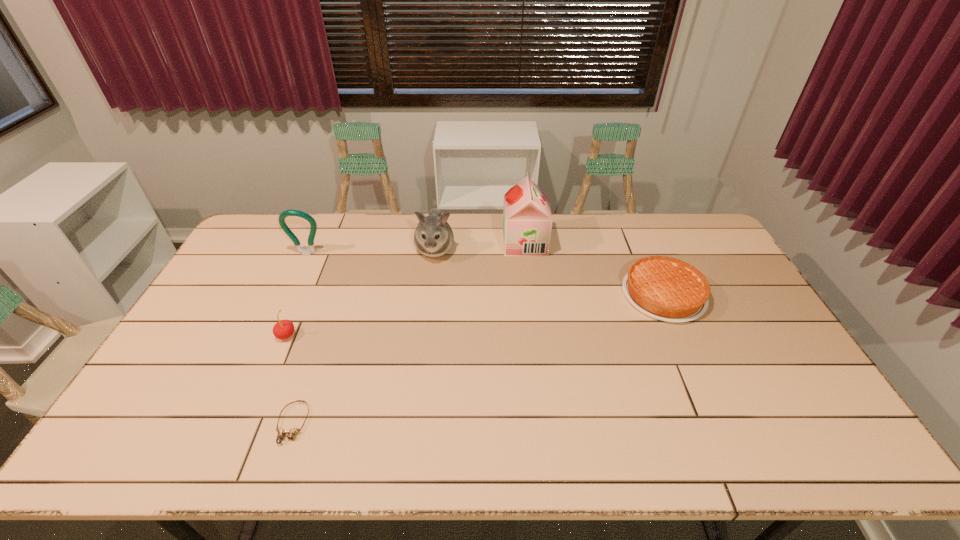
I want to click on vacant area that lies between the cherry and the fifth tallest object, so click(x=475, y=315).

In order to click on empty location between the tallest object and the fourth object from right to left in this screenshot , I will do `click(409, 333)`.

Image resolution: width=960 pixels, height=540 pixels. What are the coordinates of `vacant region between the fourth object from right to left and the cherry` in the screenshot? It's located at (289, 379).

This screenshot has height=540, width=960. I want to click on vacant space that's between the hamster and the bottle opener, so click(371, 252).

You are a GUI agent. You are given a task and a screenshot of the screen. Output one action in this format:
    pyautogui.click(x=<x>, y=<y>)
    Task: Click on the empty space between the hamster and the tallest object
    The height and width of the screenshot is (540, 960).
    Given the screenshot: What is the action you would take?
    pyautogui.click(x=480, y=246)

Identify the location of empty space that is in between the second shortest object and the third object from right to left. The width and height of the screenshot is (960, 540). (549, 272).

Identify the location of object that is the closest to the pie. The image size is (960, 540). (527, 220).

Identify which object is the fourth nearest to the fourth tallest object. Please provide its 2D coordinates. Your answer should be formatted as a tuple, i.e. [(x, y)], where the tuple contains the x and y coordinates of a point satisfying the conditions above.

[(527, 220)]

At what (x,y) coordinates should I click in order to perform the action: click on free location that satisfies the following two spatial constraints: 1. with the cap open on the second object from right to left; 2. on the face of the hamster. Please return your answer as a coordinate pair (x, y). Looking at the image, I should click on (525, 249).

The image size is (960, 540). I want to click on blank area in the image that satisfies the following two spatial constraints: 1. with the cap open on the tallest object; 2. on the face of the hamster, so click(x=525, y=249).